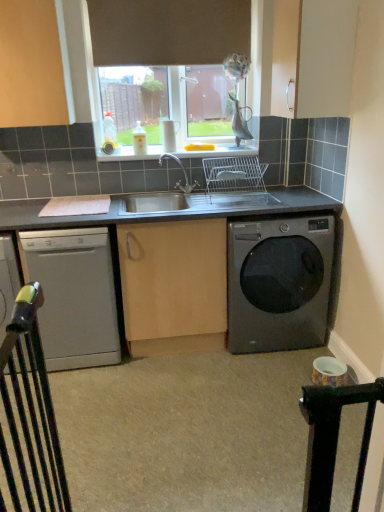
Locate an element on the screen. The height and width of the screenshot is (512, 384). satin silver dishwasher at lower left is located at coordinates (74, 296).

Measure the distance between point (160,198) and camera.

Point (160,198) and camera are 8.85 feet apart from each other.

Where is `black metal gate at lower left`? This screenshot has height=512, width=384. black metal gate at lower left is located at coordinates (30, 414).

Is stainless steel sink at center inside the boundaries of black metal gate at lower left, or outside?

stainless steel sink at center lies outside black metal gate at lower left.

Which object is closer to the camera taking this photo, stainless steel sink at center or black metal gate at lower left?

Positioned in front is black metal gate at lower left.

Consider the image. Is stainless steel sink at center positioned with its back to black metal gate at lower left?

No, stainless steel sink at center is not facing away from black metal gate at lower left.

From the image's perspective, which one is positioned lower, satin silver dishwasher at lower left or metallic gray washing machine at lower right?

satin silver dishwasher at lower left appears lower in the image.

Which of these two, satin silver dishwasher at lower left or metallic gray washing machine at lower right, stands taller?

With more height is satin silver dishwasher at lower left.

From the picture: Between satin silver dishwasher at lower left and metallic gray washing machine at lower right, which one is positioned behind?

metallic gray washing machine at lower right is behind.

Locate an element on the screen. The height and width of the screenshot is (512, 384). dishwasher located above the metallic gray washing machine at lower right (from a real-world perspective) is located at coordinates (74, 296).

Considering the sizes of objects black metal gate at lower left and satin silver dishwasher at lower left in the image provided, who is wider, black metal gate at lower left or satin silver dishwasher at lower left?

Wider between the two is satin silver dishwasher at lower left.

Considering the points (22, 337) and (74, 290), which point is in front, point (22, 337) or point (74, 290)?

The point (22, 337) is closer.

The height and width of the screenshot is (512, 384). In order to click on rail that appears on the right of satin silver dishwasher at lower left in this screenshot , I will do `click(30, 414)`.

Who is more distant, black metal gate at lower left or satin silver dishwasher at lower left?

satin silver dishwasher at lower left is more distant.

Which of these two, stainless steel sink at center or metallic gray washing machine at lower right, is wider?

metallic gray washing machine at lower right is wider.

Does stainless steel sink at center turn towards metallic gray washing machine at lower right?

No, stainless steel sink at center is not facing towards metallic gray washing machine at lower right.

Which is more to the left, stainless steel sink at center or metallic gray washing machine at lower right?

stainless steel sink at center is more to the left.

In order to click on sink that is above the metallic gray washing machine at lower right (from a real-world perspective) in this screenshot , I will do `click(209, 191)`.

Is metallic gray washing machine at lower right in front of stainless steel sink at center?

That is False.

Can you confirm if metallic gray washing machine at lower right is bigger than stainless steel sink at center?

Indeed, metallic gray washing machine at lower right has a larger size compared to stainless steel sink at center.

The width and height of the screenshot is (384, 512). In the image, there is a metallic gray washing machine at lower right. What are the coordinates of `sink above it (from the image's perspective)` in the screenshot? It's located at (209, 191).

Who is taller, metallic gray washing machine at lower right or stainless steel sink at center?

Standing taller between the two is metallic gray washing machine at lower right.

From the image's perspective, is metallic gray washing machine at lower right below satin silver dishwasher at lower left?

No.

Is metallic gray washing machine at lower right far away from satin silver dishwasher at lower left?

metallic gray washing machine at lower right is actually quite close to satin silver dishwasher at lower left.

Could you tell me if metallic gray washing machine at lower right is turned towards satin silver dishwasher at lower left?

No, metallic gray washing machine at lower right is not facing towards satin silver dishwasher at lower left.

Does metallic gray washing machine at lower right come in front of satin silver dishwasher at lower left?

No, metallic gray washing machine at lower right is behind satin silver dishwasher at lower left.

Which of these two, satin silver dishwasher at lower left or black metal gate at lower left, stands taller?

satin silver dishwasher at lower left is taller.

How far apart are satin silver dishwasher at lower left and black metal gate at lower left?

satin silver dishwasher at lower left is 30.38 inches from black metal gate at lower left.

At what (x,y) coordinates should I click in order to perform the action: click on dishwasher below the black metal gate at lower left (from a real-world perspective). Please return your answer as a coordinate pair (x, y). The image size is (384, 512). Looking at the image, I should click on (74, 296).

Can you tell me how much satin silver dishwasher at lower left and black metal gate at lower left differ in facing direction?

There is a 90-degree angle between the facing directions of satin silver dishwasher at lower left and black metal gate at lower left.

Image resolution: width=384 pixels, height=512 pixels. What are the coordinates of `rail in front of the stainless steel sink at center` in the screenshot? It's located at (30, 414).

Locate an element on the screen. washing machine to the right of satin silver dishwasher at lower left is located at coordinates (278, 283).

Looking at the image, which one is located closer to satin silver dishwasher at lower left, black metal gate at lower left or stainless steel sink at center?

stainless steel sink at center is closer to satin silver dishwasher at lower left.

From the image, which object appears to be farther from stainless steel sink at center, metallic gray washing machine at lower right or black metal gate at lower left?

black metal gate at lower left is positioned further to the anchor stainless steel sink at center.

Looking at the image, which one is located further to satin silver dishwasher at lower left, black metal gate at lower left or metallic gray washing machine at lower right?

metallic gray washing machine at lower right is further to satin silver dishwasher at lower left.

When comparing their distances from metallic gray washing machine at lower right, does stainless steel sink at center or satin silver dishwasher at lower left seem further?

satin silver dishwasher at lower left.

Considering their positions, is metallic gray washing machine at lower right positioned closer to black metal gate at lower left than stainless steel sink at center?

The object closer to black metal gate at lower left is stainless steel sink at center.

Looking at this image, looking at the image, which one is located further to black metal gate at lower left, stainless steel sink at center or metallic gray washing machine at lower right?

Among the two, metallic gray washing machine at lower right is located further to black metal gate at lower left.

Looking at the image, which one is located further to stainless steel sink at center, black metal gate at lower left or satin silver dishwasher at lower left?

The object further to stainless steel sink at center is black metal gate at lower left.

Based on their spatial positions, is black metal gate at lower left or stainless steel sink at center further from metallic gray washing machine at lower right?

black metal gate at lower left is further to metallic gray washing machine at lower right.

Locate an element on the screen. sink located between black metal gate at lower left and metallic gray washing machine at lower right in the depth direction is located at coordinates (209, 191).

The image size is (384, 512). Identify the location of sink between satin silver dishwasher at lower left and metallic gray washing machine at lower right from left to right. tap(209, 191).

Identify the location of dishwasher between black metal gate at lower left and stainless steel sink at center in the front-back direction. (74, 296).

This screenshot has width=384, height=512. I want to click on dishwasher between black metal gate at lower left and metallic gray washing machine at lower right from front to back, so click(x=74, y=296).